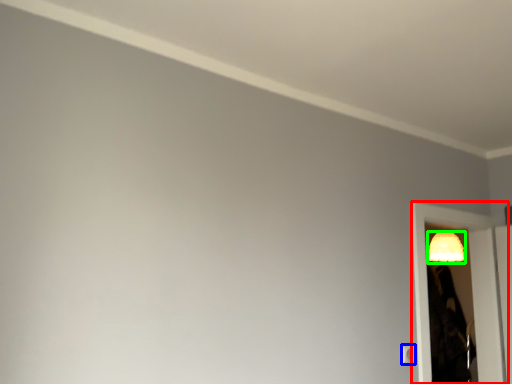
Question: Based on their relative distances, which object is nearer to screen door (highlighted by a red box)? Choose from light switch (highlighted by a blue box) and lamp (highlighted by a green box).

Choices:
 (A) light switch
 (B) lamp

Answer: (B)